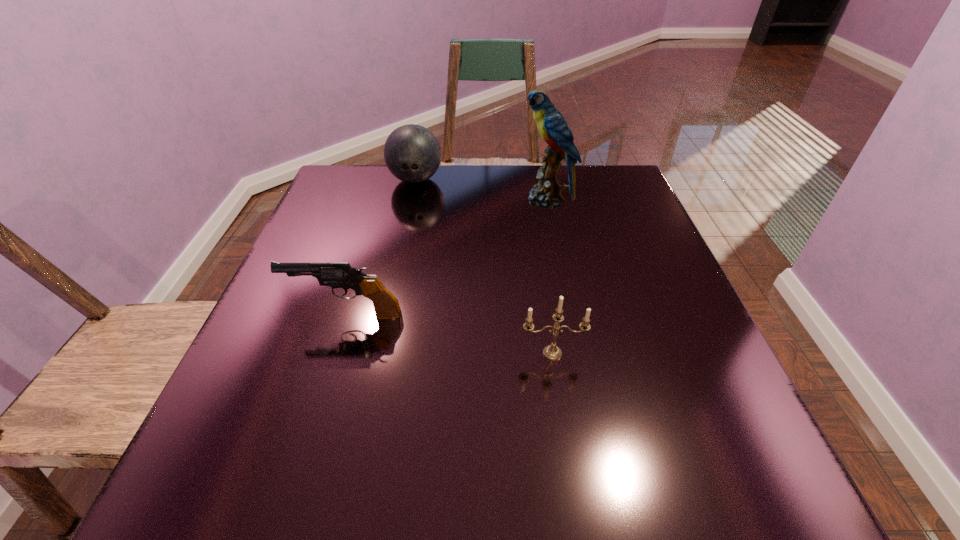
The width and height of the screenshot is (960, 540). I want to click on the closest object to the gun, so click(x=551, y=352).

Where is `vacant region that satisfies the following two spatial constraints: 1. on the grip area of the candle; 2. on the right side of the bowling ball`? Image resolution: width=960 pixels, height=540 pixels. vacant region that satisfies the following two spatial constraints: 1. on the grip area of the candle; 2. on the right side of the bowling ball is located at coordinates (378, 353).

At what (x,y) coordinates should I click in order to perform the action: click on free space that satisfies the following two spatial constraints: 1. on the grip area of the bowling ball; 2. on the left side of the candle. Please return your answer as a coordinate pair (x, y). This screenshot has height=540, width=960. Looking at the image, I should click on (378, 353).

This screenshot has height=540, width=960. I want to click on vacant area in the image that satisfies the following two spatial constraints: 1. on the grip area of the candle; 2. on the left side of the bowling ball, so click(378, 353).